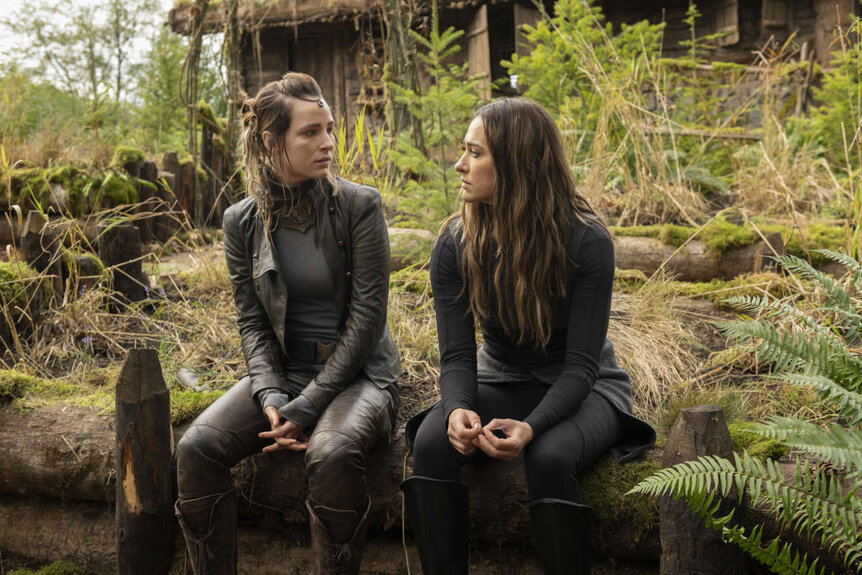
This screenshot has height=575, width=862. Find the location of `bench`. bench is located at coordinates (38, 453).